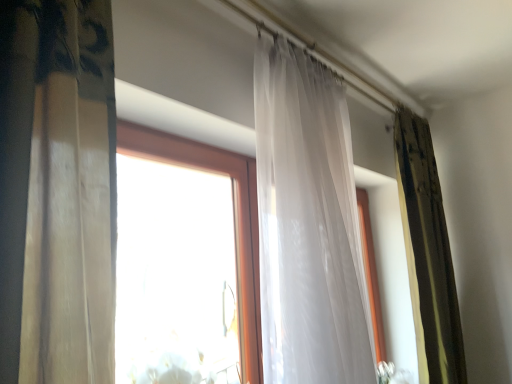
The height and width of the screenshot is (384, 512). Describe the element at coordinates (428, 254) in the screenshot. I see `green textured curtain at right, arranged as the first curtain when viewed from the right` at that location.

Locate an element on the screen. The image size is (512, 384). green textured curtain at right, acting as the 2th curtain starting from the front is located at coordinates (428, 254).

How much space does translucent white curtain at center, arranged as the first curtain when viewed from the left, occupy vertically?

translucent white curtain at center, arranged as the first curtain when viewed from the left, is 1.25 meters in height.

Describe the element at coordinates (308, 225) in the screenshot. This screenshot has height=384, width=512. I see `translucent white curtain at center, marked as the 2th curtain in a back-to-front arrangement` at that location.

Find the location of a particular element. translucent white curtain at center, which is counted as the 2th curtain, starting from the right is located at coordinates [x=308, y=225].

The height and width of the screenshot is (384, 512). I want to click on green textured curtain at right, the 2th curtain viewed from the left, so click(428, 254).

Can you confirm if translucent white curtain at center, marked as the 2th curtain in a back-to-front arrangement, is positioned to the left of green textured curtain at right, the 2th curtain viewed from the left?

Yes, translucent white curtain at center, marked as the 2th curtain in a back-to-front arrangement, is to the left of green textured curtain at right, the 2th curtain viewed from the left.

Between translucent white curtain at center, which is counted as the 2th curtain, starting from the right, and green textured curtain at right, the 2th curtain viewed from the left, which one is positioned in front?

translucent white curtain at center, which is counted as the 2th curtain, starting from the right, is closer to the camera.

Is point (261, 152) positioned before point (417, 195)?

Yes.

From the image's perspective, is translucent white curtain at center, which is counted as the 2th curtain, starting from the right, above green textured curtain at right, arranged as the first curtain when viewed from the right?

Yes.

From a real-world perspective, between translucent white curtain at center, marked as the 2th curtain in a back-to-front arrangement, and green textured curtain at right, acting as the 2th curtain starting from the front, who is vertically lower?

green textured curtain at right, acting as the 2th curtain starting from the front, is physically lower.

Looking at this image, which of these two, translucent white curtain at center, positioned as the first curtain in front-to-back order, or green textured curtain at right, acting as the 2th curtain starting from the front, is wider?

translucent white curtain at center, positioned as the first curtain in front-to-back order, is wider.

From their relative heights in the image, would you say translucent white curtain at center, positioned as the first curtain in front-to-back order, is taller or shorter than green textured curtain at right, acting as the 2th curtain starting from the front?

Considering their sizes, translucent white curtain at center, positioned as the first curtain in front-to-back order, has less height than green textured curtain at right, acting as the 2th curtain starting from the front.

Is translucent white curtain at center, positioned as the first curtain in front-to-back order, smaller than green textured curtain at right, acting as the 2th curtain starting from the front?

No, translucent white curtain at center, positioned as the first curtain in front-to-back order, is not smaller than green textured curtain at right, acting as the 2th curtain starting from the front.

Is green textured curtain at right, the first curtain viewed from the back, located within translucent white curtain at center, arranged as the first curtain when viewed from the left?

No, green textured curtain at right, the first curtain viewed from the back, is located outside of translucent white curtain at center, arranged as the first curtain when viewed from the left.

Is translucent white curtain at center, arranged as the first curtain when viewed from the left, in contact with green textured curtain at right, the first curtain viewed from the back?

No.

Could you tell me if translucent white curtain at center, positioned as the first curtain in front-to-back order, is turned towards green textured curtain at right, the first curtain viewed from the back?

No, translucent white curtain at center, positioned as the first curtain in front-to-back order, is not facing towards green textured curtain at right, the first curtain viewed from the back.

How many degrees apart are the facing directions of translucent white curtain at center, arranged as the first curtain when viewed from the left, and green textured curtain at right, arranged as the first curtain when viewed from the right?

translucent white curtain at center, arranged as the first curtain when viewed from the left, and green textured curtain at right, arranged as the first curtain when viewed from the right, are facing 1.14 degrees away from each other.

Find the location of `curtain in front of the green textured curtain at right, acting as the 2th curtain starting from the front`. curtain in front of the green textured curtain at right, acting as the 2th curtain starting from the front is located at coordinates (308, 225).

Considering the positions of objects green textured curtain at right, the first curtain viewed from the back, and translucent white curtain at center, marked as the 2th curtain in a back-to-front arrangement, in the image provided, who is more to the right, green textured curtain at right, the first curtain viewed from the back, or translucent white curtain at center, marked as the 2th curtain in a back-to-front arrangement,?

Positioned to the right is green textured curtain at right, the first curtain viewed from the back.

Is green textured curtain at right, the first curtain viewed from the back, behind translucent white curtain at center, marked as the 2th curtain in a back-to-front arrangement?

Yes, it is behind translucent white curtain at center, marked as the 2th curtain in a back-to-front arrangement.

Does point (403, 128) lie in front of point (295, 156)?

No, it is not.

From the image's perspective, who appears lower, green textured curtain at right, arranged as the first curtain when viewed from the right, or translucent white curtain at center, positioned as the first curtain in front-to-back order?

green textured curtain at right, arranged as the first curtain when viewed from the right, from the image's perspective.

From a real-world perspective, is green textured curtain at right, acting as the 2th curtain starting from the front, positioned above or below translucent white curtain at center, positioned as the first curtain in front-to-back order?

In terms of real-world spatial position, green textured curtain at right, acting as the 2th curtain starting from the front, is below translucent white curtain at center, positioned as the first curtain in front-to-back order.

Which object is thinner, green textured curtain at right, arranged as the first curtain when viewed from the right, or translucent white curtain at center, which is counted as the 2th curtain, starting from the right?

green textured curtain at right, arranged as the first curtain when viewed from the right, is thinner.

From their relative heights in the image, would you say green textured curtain at right, the 2th curtain viewed from the left, is taller or shorter than translucent white curtain at center, which is counted as the 2th curtain, starting from the right?

In the image, green textured curtain at right, the 2th curtain viewed from the left, appears to be taller than translucent white curtain at center, which is counted as the 2th curtain, starting from the right.

Considering the sizes of objects green textured curtain at right, acting as the 2th curtain starting from the front, and translucent white curtain at center, which is counted as the 2th curtain, starting from the right, in the image provided, who is smaller, green textured curtain at right, acting as the 2th curtain starting from the front, or translucent white curtain at center, which is counted as the 2th curtain, starting from the right,?

green textured curtain at right, acting as the 2th curtain starting from the front, is smaller.

Would you say green textured curtain at right, arranged as the first curtain when viewed from the right, is inside or outside translucent white curtain at center, marked as the 2th curtain in a back-to-front arrangement?

green textured curtain at right, arranged as the first curtain when viewed from the right, cannot be found inside translucent white curtain at center, marked as the 2th curtain in a back-to-front arrangement.

Are green textured curtain at right, acting as the 2th curtain starting from the front, and translucent white curtain at center, which is counted as the 2th curtain, starting from the right, far apart?

green textured curtain at right, acting as the 2th curtain starting from the front, is actually quite close to translucent white curtain at center, which is counted as the 2th curtain, starting from the right.

Is green textured curtain at right, acting as the 2th curtain starting from the front, positioned with its back to translucent white curtain at center, arranged as the first curtain when viewed from the left?

No.

What's the angular difference between green textured curtain at right, the first curtain viewed from the back, and translucent white curtain at center, arranged as the first curtain when viewed from the left,'s facing directions?

There is a 1.14-degree angle between the facing directions of green textured curtain at right, the first curtain viewed from the back, and translucent white curtain at center, arranged as the first curtain when viewed from the left.

The width and height of the screenshot is (512, 384). I want to click on curtain below the translucent white curtain at center, which is counted as the 2th curtain, starting from the right (from a real-world perspective), so click(x=428, y=254).

Locate an element on the screen. Image resolution: width=512 pixels, height=384 pixels. curtain to the left of green textured curtain at right, the first curtain viewed from the back is located at coordinates (308, 225).

Find the location of a particular element. The width and height of the screenshot is (512, 384). curtain on the right of translucent white curtain at center, marked as the 2th curtain in a back-to-front arrangement is located at coordinates (428, 254).